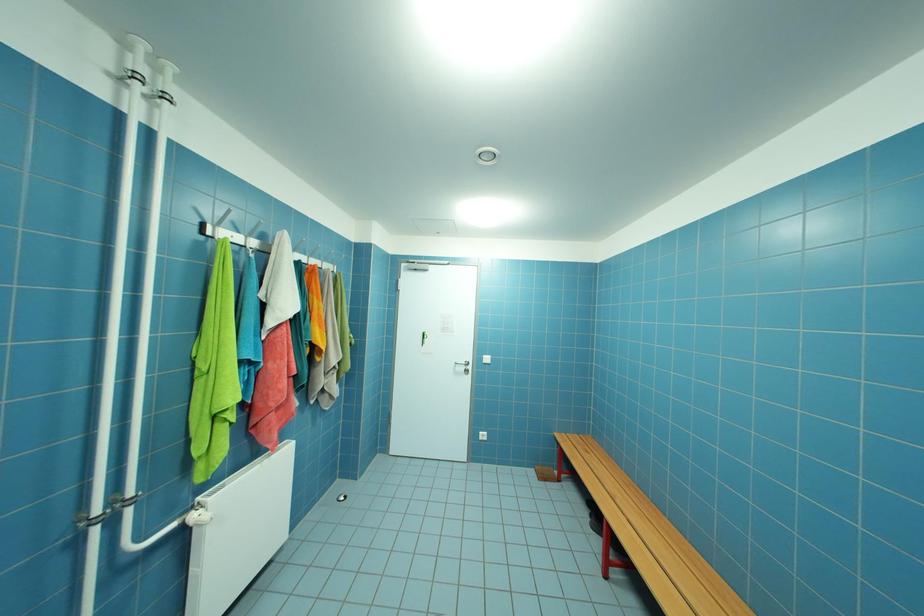
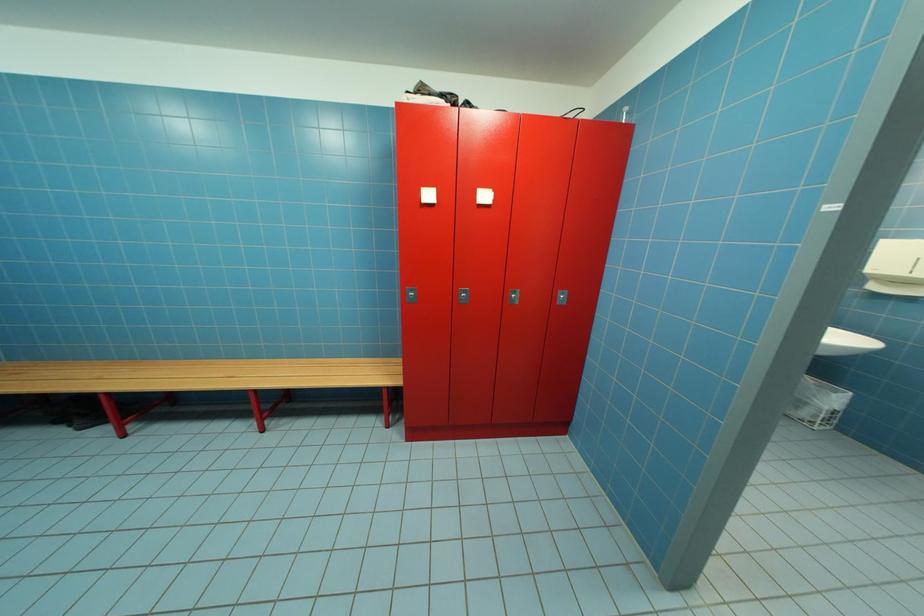
The images are taken continuously from a first-person perspective. In which direction is your viewpoint rotating?

The camera's rotation is toward right-down.